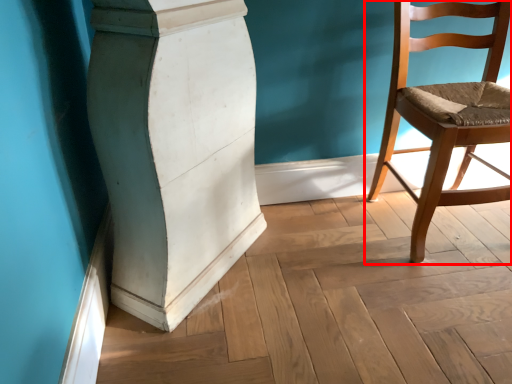
Question: Observing the image, what is the correct spatial positioning of chair (annotated by the red box) in reference to pillar?

Choices:
 (A) right
 (B) left

Answer: (A)